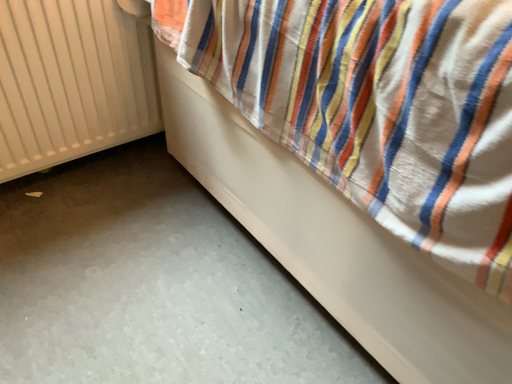
Question: Is white smooth bed at lower right in front of or behind white matte radiator at left in the image?

Choices:
 (A) front
 (B) behind

Answer: (A)

Question: Looking at the image, does white smooth bed at lower right seem bigger or smaller compared to white matte radiator at left?

Choices:
 (A) big
 (B) small

Answer: (A)

Question: Is white smooth bed at lower right inside the boundaries of white matte radiator at left, or outside?

Choices:
 (A) inside
 (B) outside

Answer: (B)

Question: From the image's perspective, is white matte radiator at left located above or below white smooth bed at lower right?

Choices:
 (A) below
 (B) above

Answer: (A)

Question: Considering their positions, is white matte radiator at left located in front of or behind white smooth bed at lower right?

Choices:
 (A) front
 (B) behind

Answer: (B)

Question: Is white matte radiator at left to the left or to the right of white smooth bed at lower right in the image?

Choices:
 (A) left
 (B) right

Answer: (A)

Question: Is white matte radiator at left bigger or smaller than white smooth bed at lower right?

Choices:
 (A) small
 (B) big

Answer: (A)